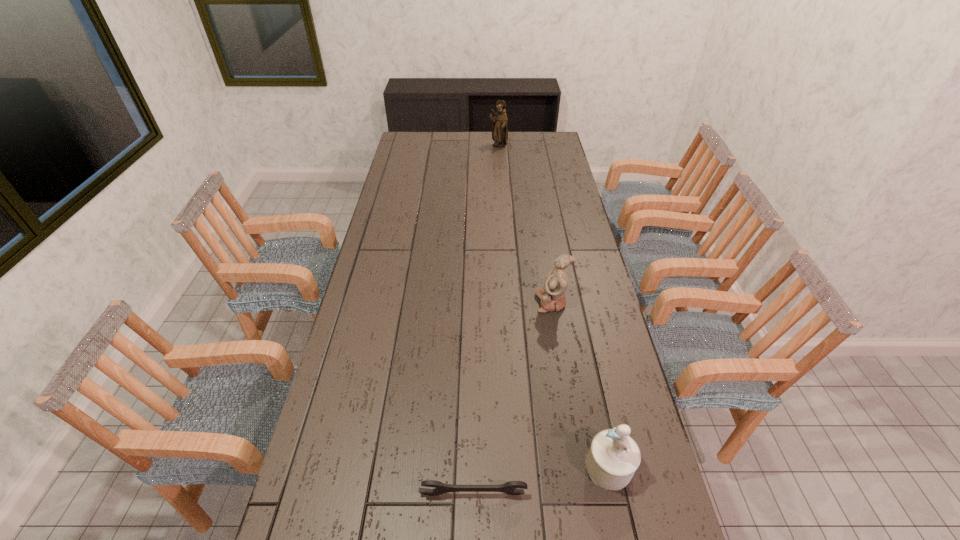
The image size is (960, 540). In order to click on the leftmost figurine in this screenshot , I will do `click(499, 123)`.

This screenshot has height=540, width=960. What are the coordinates of `the farthest object` in the screenshot? It's located at [499, 123].

What are the coordinates of `the second farthest object` in the screenshot? It's located at (552, 295).

Where is `the nearest figurine`? The image size is (960, 540). the nearest figurine is located at coordinates (613, 458).

Identify the location of the shortest object. This screenshot has width=960, height=540. (510, 487).

This screenshot has width=960, height=540. I want to click on wrench, so click(x=510, y=487).

Identify the location of vacant space positioned 0.390m on the front-facing side of the farthest figurine. (501, 190).

Image resolution: width=960 pixels, height=540 pixels. I want to click on vacant area situated 0.380m on the front-facing side of the second nearest figurine, so click(427, 302).

In order to click on vacant space situated on the front-facing side of the second nearest figurine in this screenshot , I will do `click(470, 302)`.

Where is `free spot located 0.290m on the front-facing side of the second nearest figurine`? The image size is (960, 540). free spot located 0.290m on the front-facing side of the second nearest figurine is located at coordinates (453, 302).